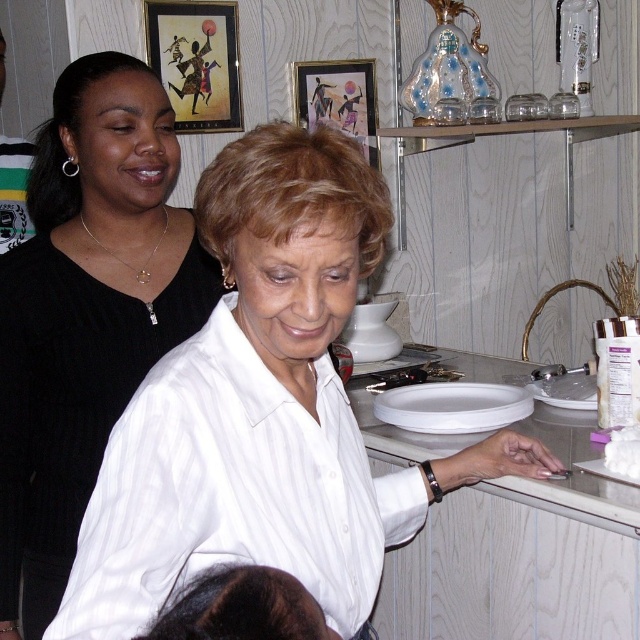
Does white glossy platter at lower center have a greater height compared to white matte platter at lower right?

Indeed, white glossy platter at lower center has a greater height compared to white matte platter at lower right.

Which is in front, point (428, 390) or point (557, 397)?

Point (557, 397) is in front.

Identify the location of white glossy platter at lower center. (452, 406).

Who is taller, white glossy platter at lower center or white fluffy bread at right?

Standing taller between the two is white glossy platter at lower center.

Is white glossy platter at lower center behind white fluffy bread at right?

Yes, white glossy platter at lower center is further from the viewer.

Is point (432, 413) positioned before point (636, 481)?

No, (432, 413) is behind (636, 481).

This screenshot has width=640, height=640. Identify the location of white glossy platter at lower center. (452, 406).

Between point (332, 244) and point (502, 413), which one is positioned in front?

Positioned in front is point (332, 244).

Is white matte shirt at center smaller than white glossy platter at lower center?

Incorrect, white matte shirt at center is not smaller in size than white glossy platter at lower center.

What do you see at coordinates (262, 410) in the screenshot? The image size is (640, 640). I see `white matte shirt at center` at bounding box center [262, 410].

This screenshot has height=640, width=640. Identify the location of white matte shirt at center. (262, 410).